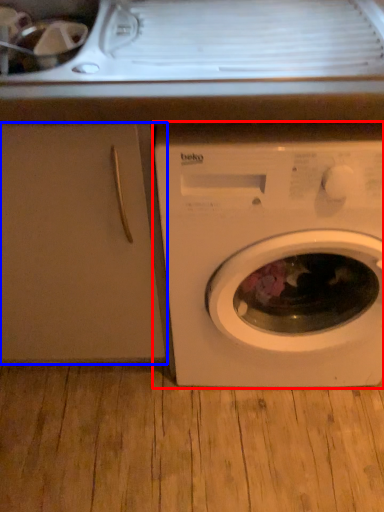
Question: Which object is closer to the camera taking this photo, washing machine (highlighted by a red box) or screen door (highlighted by a blue box)?

Choices:
 (A) washing machine
 (B) screen door

Answer: (A)